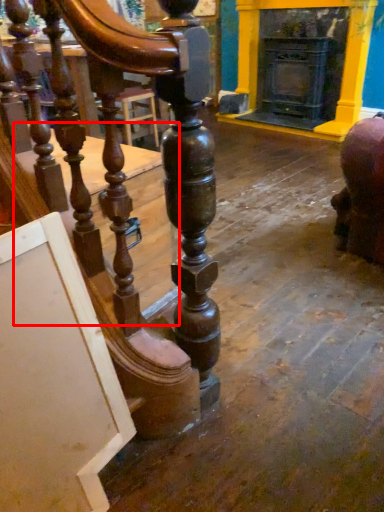
Question: In this image, where is table (annotated by the red box) located relative to fireplace?

Choices:
 (A) right
 (B) left

Answer: (B)